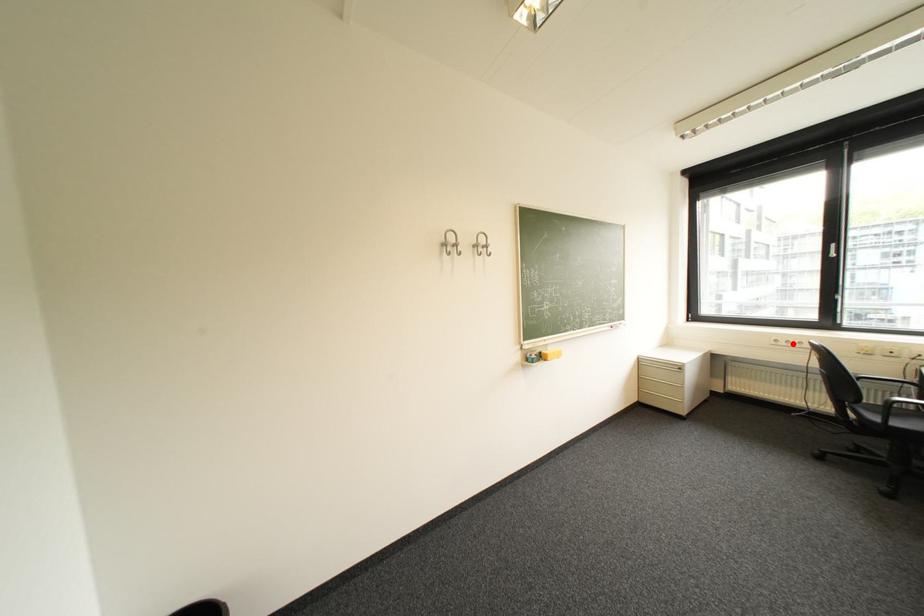
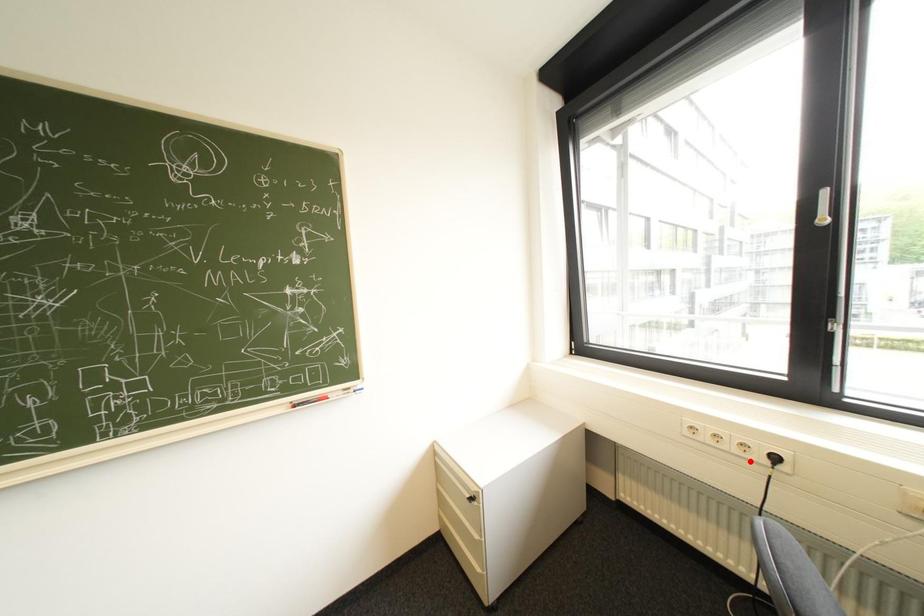
I am providing you with two images of the same scene from different viewpoints. A red point is marked on the first image and another point is marked on the second image. Are the points marked in image1 and image2 representing the same 3D position?

No